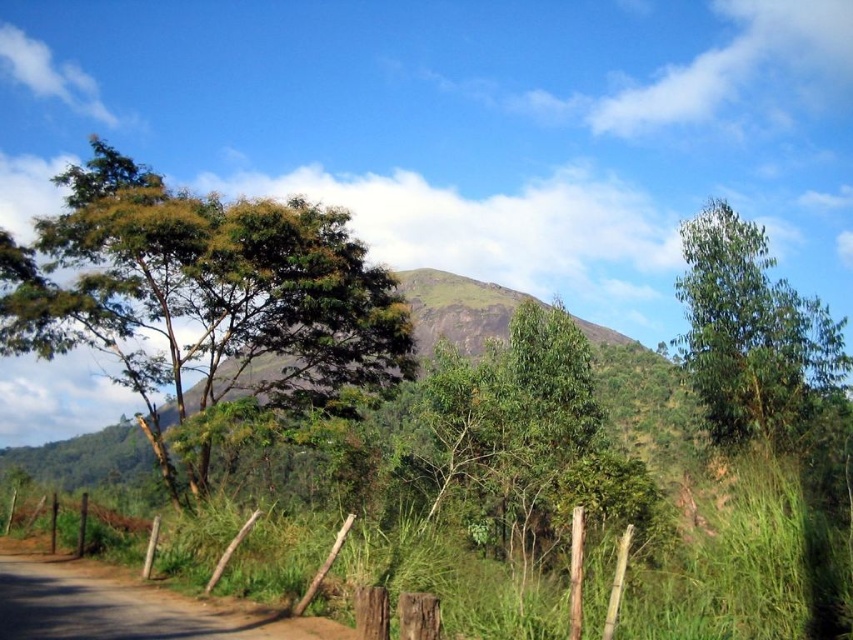
Question: Estimate the real-world distances between objects in this image. Which object is closer to the green leafy tree at upper right?

Choices:
 (A) dirt road at lower left
 (B) brown wooden posts at lower left
 (C) green leafy tree at left

Answer: (B)

Question: Does brown wooden posts at lower left appear on the right side of dirt road at lower left?

Choices:
 (A) no
 (B) yes

Answer: (A)

Question: Which point is closer to the camera taking this photo?

Choices:
 (A) (184, 621)
 (B) (706, 266)
 (C) (142, 609)

Answer: (A)

Question: Does green leafy tree at left have a lesser width compared to dirt road at lower left?

Choices:
 (A) yes
 (B) no

Answer: (B)

Question: Among these objects, which one is nearest to the camera?

Choices:
 (A) brown wooden posts at lower left
 (B) green leafy tree at left

Answer: (A)

Question: Is green leafy tree at left positioned in front of brown wooden posts at lower left?

Choices:
 (A) no
 (B) yes

Answer: (A)